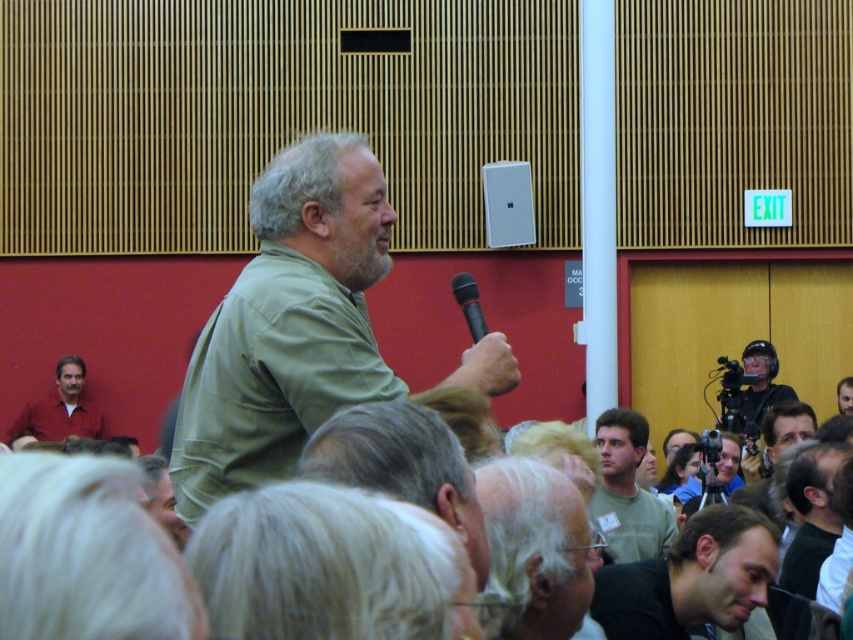
You are standing in the conference room and want to take a photo of the speaker wearing the green matte shirt at center. The camera you have can focus clearly up to 20 meters. Will the camera be able to capture the speaker clearly?

The green matte shirt at center and the camera are 22.37 meters apart, which is beyond the camera maximum focus distance of 20 meters. The camera will not be able to capture the speaker clearly.

You are an event organizer and need to ensure all speakers have proper equipment. You notice the matte red shirt at lower left and the black plastic microphone at upper center in the image. Which object is wider?

The matte red shirt at lower left is wider than the black plastic microphone at upper center.